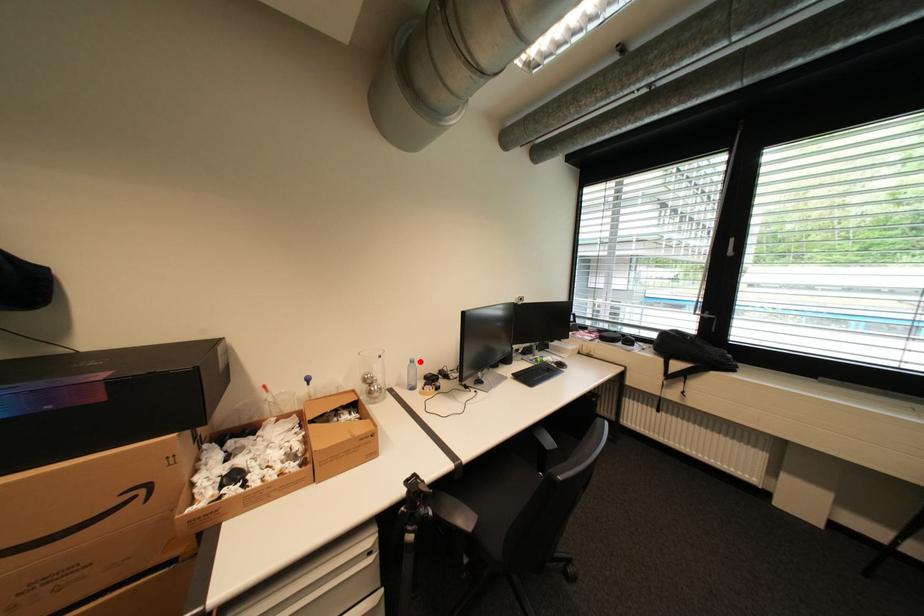
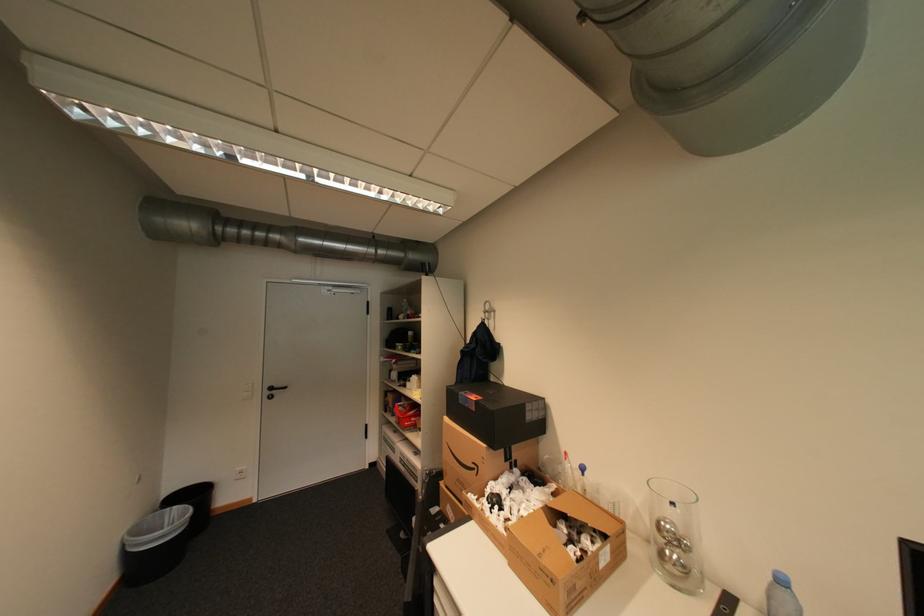
In the second image, find the point that corresponds to the highlighted location in the first image.

(791, 582)